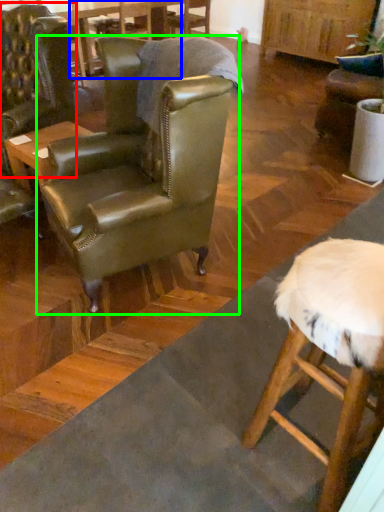
Question: Which is nearer to the chair (highlighted by a red box)? table (highlighted by a blue box) or chair (highlighted by a green box).

Choices:
 (A) table
 (B) chair

Answer: (B)